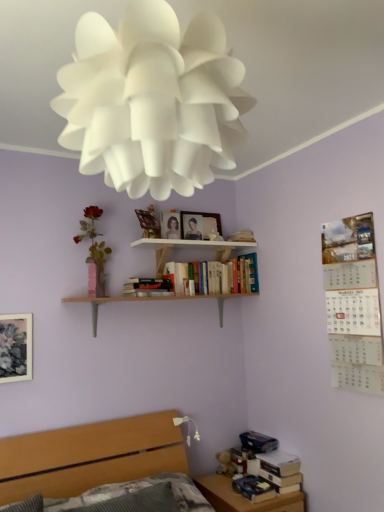
Question: Can you confirm if light wood/roughobject at center, the first shelf from the bottom, is positioned to the left of wooden table at lower right?

Choices:
 (A) no
 (B) yes

Answer: (B)

Question: Is light wood/roughobject at center, arranged as the second shelf when viewed from the top, not near wooden table at lower right?

Choices:
 (A) yes
 (B) no

Answer: (A)

Question: From a real-world perspective, is light wood/roughobject at center, the first shelf from the bottom, physically below wooden table at lower right?

Choices:
 (A) no
 (B) yes

Answer: (A)

Question: Is wooden table at lower right at the back of light wood/roughobject at center, arranged as the second shelf when viewed from the top?

Choices:
 (A) yes
 (B) no

Answer: (B)

Question: Can you confirm if light wood/roughobject at center, the first shelf from the bottom, is wider than wooden table at lower right?

Choices:
 (A) yes
 (B) no

Answer: (B)

Question: Is light wood/roughobject at center, the first shelf from the bottom, shorter than wooden table at lower right?

Choices:
 (A) no
 (B) yes

Answer: (B)

Question: Is matte floral print picture frame at left, acting as the first picture frame starting from the front, facing away from wooden table at lower right?

Choices:
 (A) yes
 (B) no

Answer: (B)

Question: From the image's perspective, does matte floral print picture frame at left, which is counted as the 3th picture frame, starting from the right, appear higher than wooden table at lower right?

Choices:
 (A) yes
 (B) no

Answer: (A)

Question: From a real-world perspective, is matte floral print picture frame at left, arranged as the 3th picture frame when viewed from the back, physically above wooden table at lower right?

Choices:
 (A) no
 (B) yes

Answer: (B)

Question: Can you confirm if matte floral print picture frame at left, arranged as the 3th picture frame when viewed from the back, is bigger than wooden table at lower right?

Choices:
 (A) yes
 (B) no

Answer: (B)

Question: Is matte floral print picture frame at left, the third picture frame from the top, at the left side of wooden table at lower right?

Choices:
 (A) yes
 (B) no

Answer: (A)

Question: Does matte floral print picture frame at left, acting as the first picture frame starting from the front, turn towards wooden table at lower right?

Choices:
 (A) no
 (B) yes

Answer: (A)

Question: Does matte wooden picture frame at upper center, which is the 2th picture frame from right to left, have a smaller size compared to white paper flower at upper center, which appears as the 2th flower when ordered from the bottom?

Choices:
 (A) no
 (B) yes

Answer: (B)